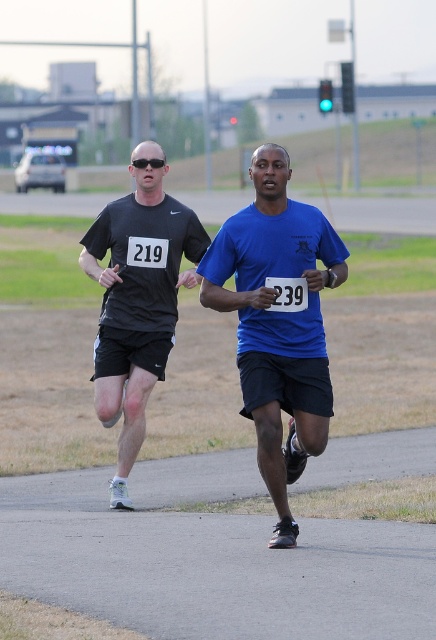
You are a race official observing the runners. You need to determine which runner is shorter based on their shirts. Which one is shorter between the blue matte shirt at center and the matte black shirt at left?

The blue matte shirt at center is not as tall as the matte black shirt at left, so the blue matte shirt at center is shorter.

You are a race organizer and need to ensure that the blue matte shirt at center and the matte black shirt at left are visible to the judges. Considering their sizes, which shirt might be harder to see from a distance and why?

The blue matte shirt at center is smaller in size compared to the matte black shirt at left, so it might be harder to see from a distance because it is smaller.

You are a photographer standing at the starting line of the race. You want to take a photo that includes both the point at coordinates point (269, 304) and the point at coordinates point (143, 384). Which point will appear larger in your photo?

Point (269, 304) is closer to the viewer than point (143, 384), so it will appear larger in the photo.